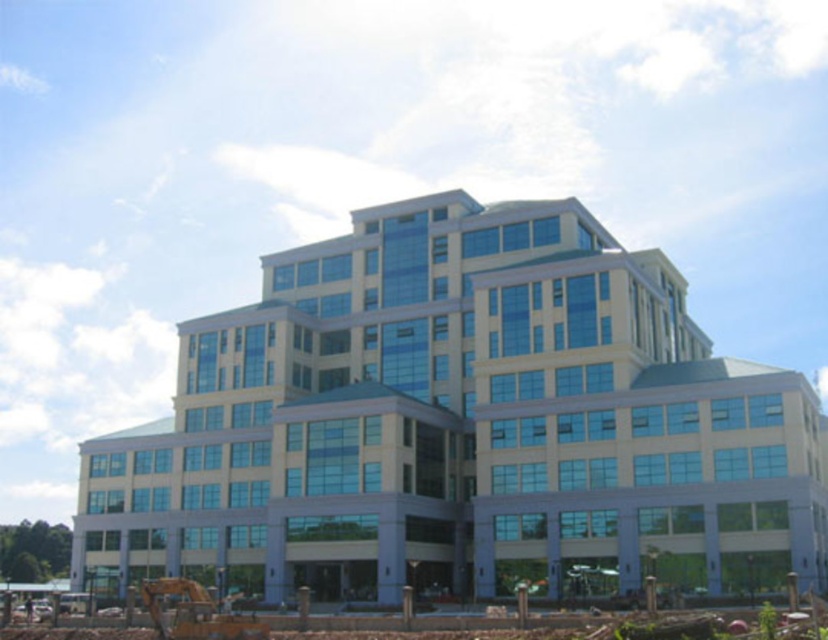
You are an architect evaluating the building site. You need to determine if the blue glass building at center can be expanded horizontally to match the brown dirt at lower left in width. Based on the current dimensions, what is your assessment?

The blue glass building at center is already wider than the brown dirt at lower left, so it cannot be expanded further to match the dirt width.

You are standing at a point where you can see the entire building. You want to place a flag exactly halfway between your current position and the point marked as point (720, 586). How far will the flag be from your current position?

The flag will be placed at half the distance between your current position and point (720, 586). Since the distance is 56.95 meters, the flag will be 28.475 meters away from your current position.

You are a construction worker standing at the yellow metallic excavator at lower left. Looking towards the blue glass building at center, which direction should you face to have the building directly in front of you?

The blue glass building at center is positioned over the yellow metallic excavator at lower left, so facing forward from the excavator will have the building directly in front of you.